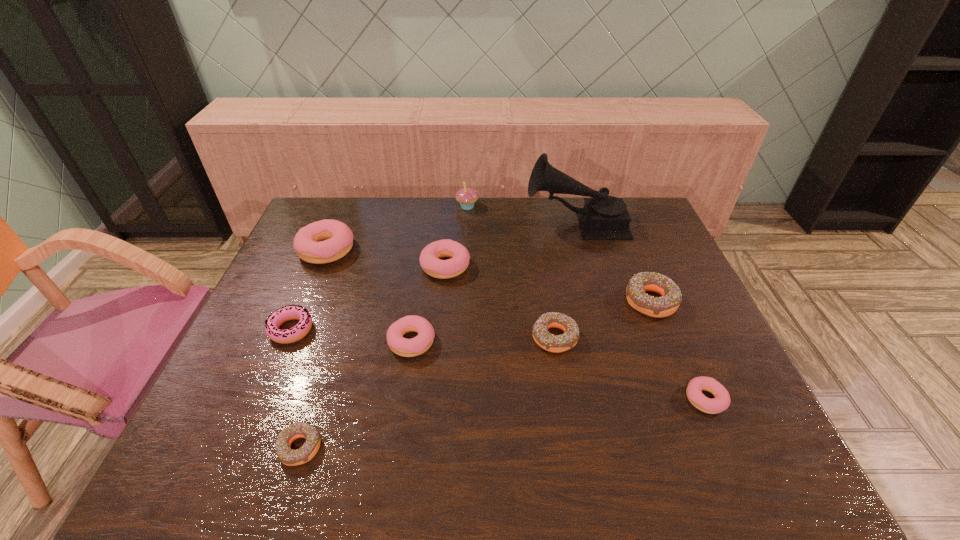
Where is `phonograph_record situated at the right edge`? The height and width of the screenshot is (540, 960). phonograph_record situated at the right edge is located at coordinates (603, 217).

You are a GUI agent. You are given a task and a screenshot of the screen. Output one action in this format:
    pyautogui.click(x=<x>, y=<y>)
    Task: Click on the object that is at the far left corner
    This screenshot has width=960, height=540.
    Given the screenshot: What is the action you would take?
    pyautogui.click(x=325, y=241)

Where is `object that is at the far right corner`? This screenshot has width=960, height=540. object that is at the far right corner is located at coordinates (603, 217).

This screenshot has width=960, height=540. I want to click on vacant area at the far edge of the desktop, so click(543, 223).

I want to click on free region at the near edge, so click(663, 456).

This screenshot has width=960, height=540. In the image, there is a desktop. Find the location of `blank space at the right edge`. blank space at the right edge is located at coordinates (731, 429).

Find the location of a particular element. vacant space at the far left corner of the desktop is located at coordinates (349, 216).

Locate an element on the screen. The height and width of the screenshot is (540, 960). vacant area between the second biggest chocolate doughnut and the third smallest pink doughnut is located at coordinates (483, 340).

Find the location of a particular element. vacant point located between the rightmost chocolate doughnut and the second nearest object is located at coordinates (678, 350).

This screenshot has height=540, width=960. I want to click on vacant space that's between the nearest doughnut and the pink cupcake, so click(384, 327).